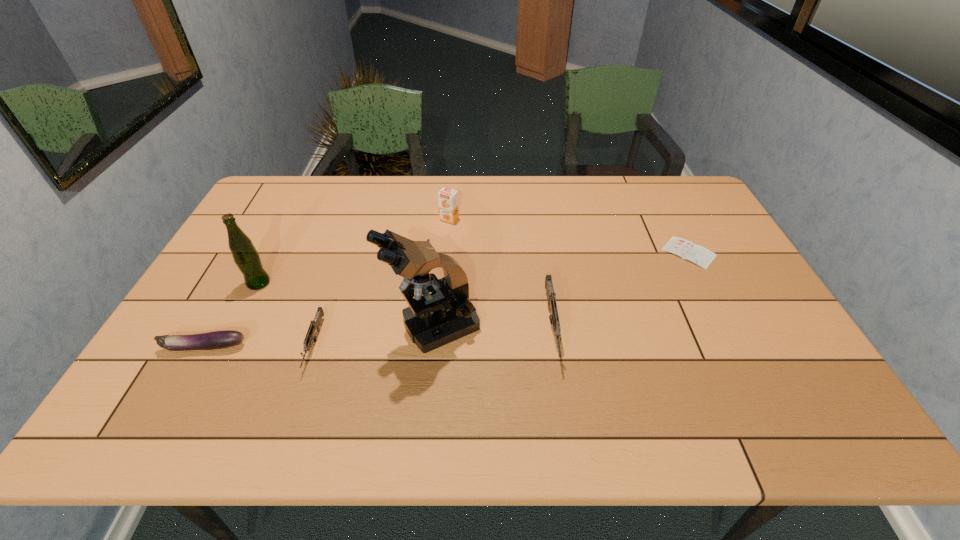
Identify the location of vacant area that lies between the third tallest object and the second tallest object. (354, 251).

This screenshot has height=540, width=960. Find the location of `free spot between the left gun and the sixth tallest object`. free spot between the left gun and the sixth tallest object is located at coordinates (259, 346).

Identify which object is the third closest to the shortest object. Please provide its 2D coordinates. Your answer should be formatted as a tuple, i.e. [(x, y)], where the tuple contains the x and y coordinates of a point satisfying the conditions above.

[(447, 199)]

Point out which object is positioned as the fifth nearest to the shorter gun. Please provide its 2D coordinates. Your answer should be formatted as a tuple, i.e. [(x, y)], where the tuple contains the x and y coordinates of a point satisfying the conditions above.

[(551, 298)]